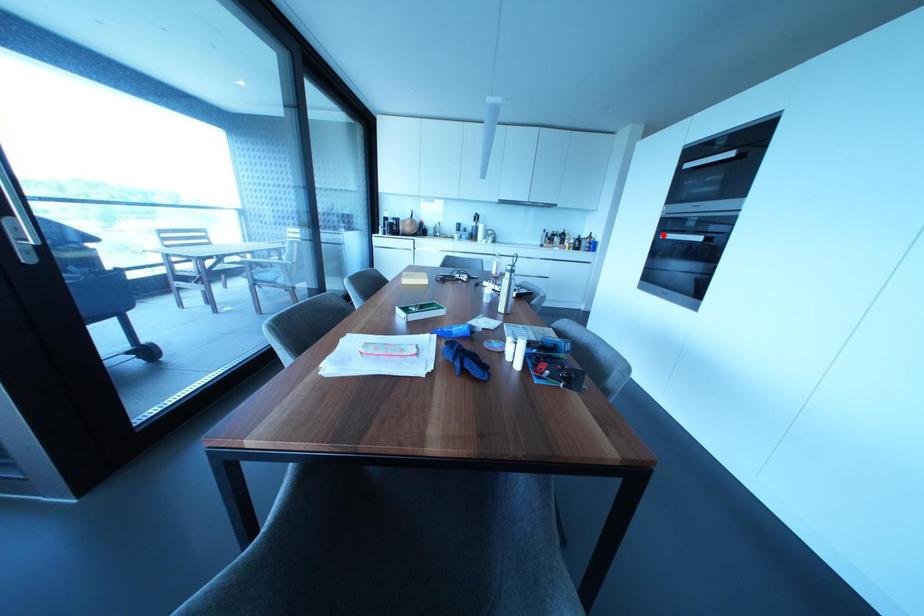
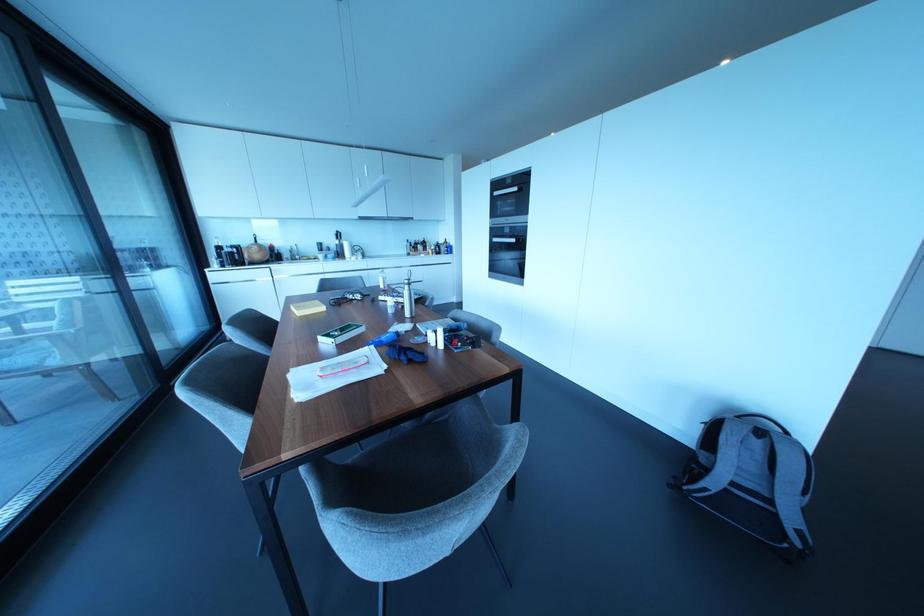
Question: I am providing you with two images of the same scene from different viewpoints. Given a red point in image1, look at the same physical point in image2. Is it:

Choices:
 (A) Closer to the viewpoint
 (B) Farther from the viewpoint

Answer: (A)